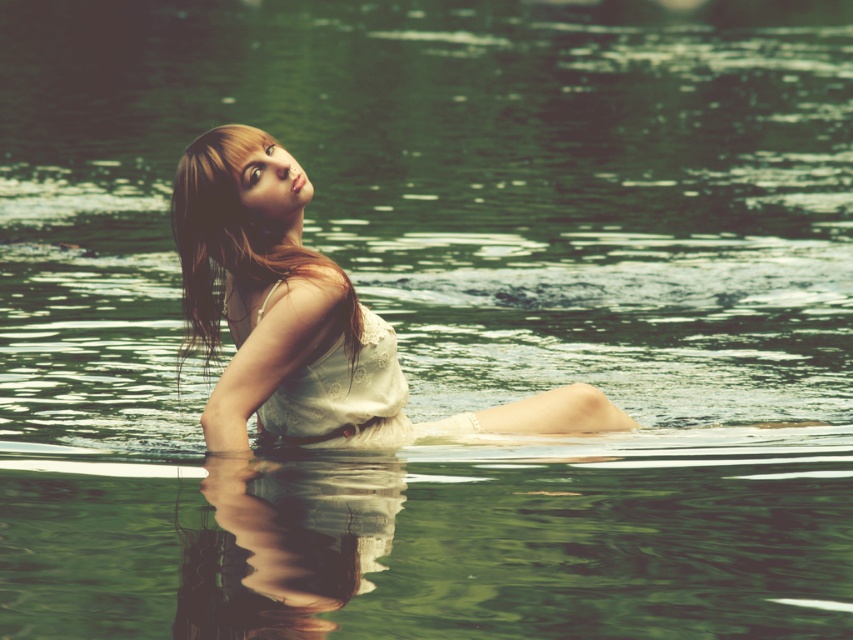
Does matte white dress at center have a lesser width compared to brown shiny hair at upper left?

In fact, matte white dress at center might be wider than brown shiny hair at upper left.

Can you confirm if matte white dress at center is shorter than brown shiny hair at upper left?

No.

Who is more distant from viewer, (343,380) or (186,212)?

The point (343,380) is more distant.

Where is `matte white dress at center`? The height and width of the screenshot is (640, 853). matte white dress at center is located at coordinates (306, 317).

Consider the image. Which is more to the left, brown shiny hair at upper left or white lace dress at center?

From the viewer's perspective, brown shiny hair at upper left appears more on the left side.

The image size is (853, 640). I want to click on brown shiny hair at upper left, so (235, 241).

Find the location of a particular element. The image size is (853, 640). brown shiny hair at upper left is located at coordinates (235, 241).

Between point (187, 179) and point (345, 404), which one is positioned behind?

The point (345, 404) is behind.

Identify the location of matte white dress at center. (306, 317).